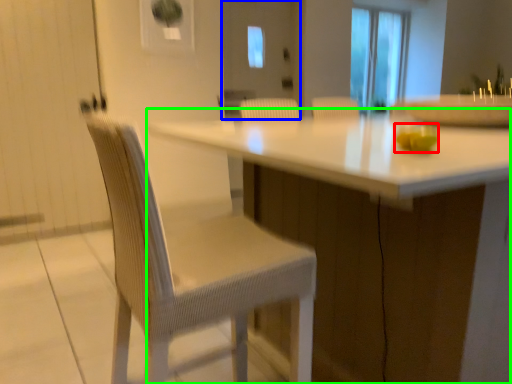
Question: Which is nearer to the food (highlighted by a red box)? screen door (highlighted by a blue box) or table (highlighted by a green box).

Choices:
 (A) screen door
 (B) table

Answer: (B)